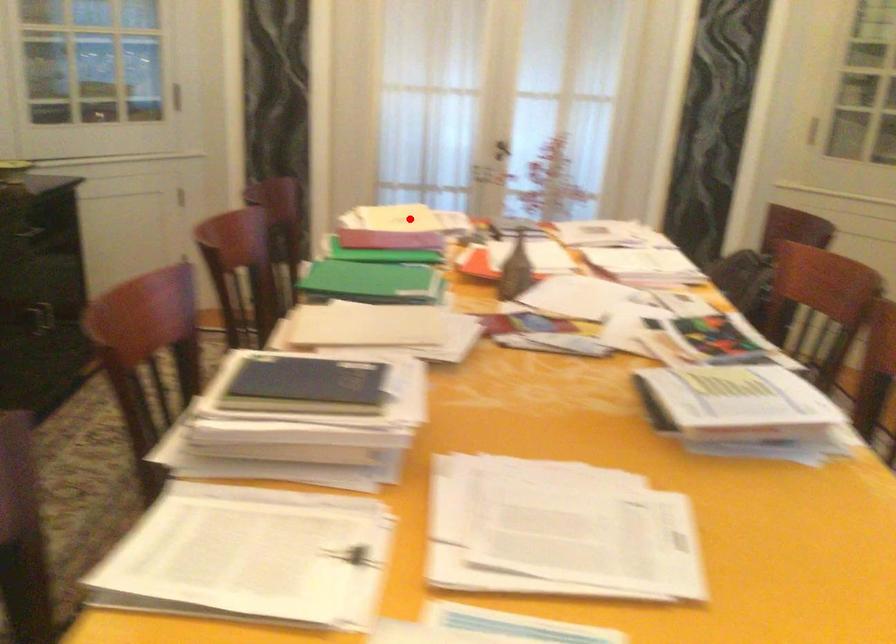
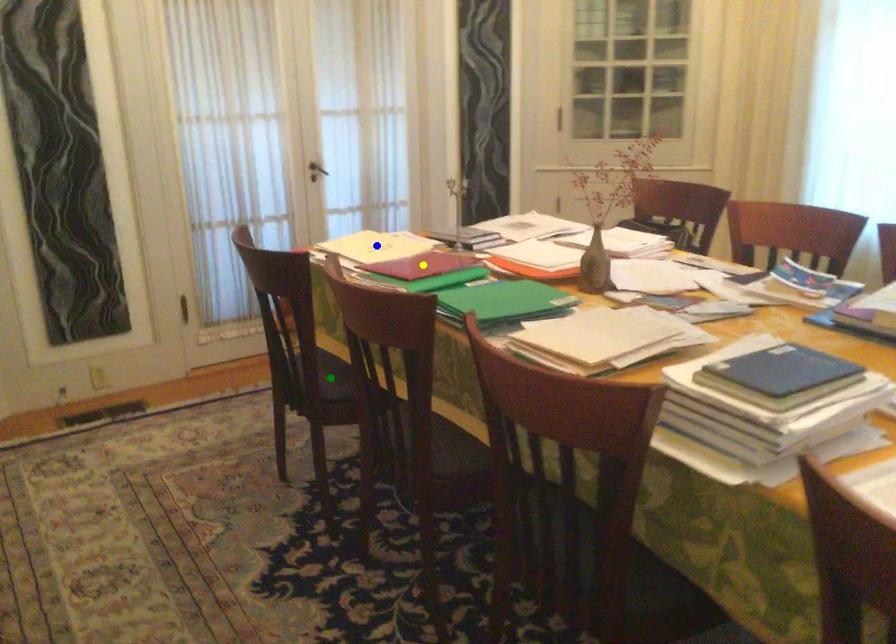
Question: I am providing you with two images of the same scene from different viewpoints. A red point is marked on the first image. You are given multiple points on the second image. Which spot in image 2 lines up with the point in image 1?

Choices:
 (A) yellow point
 (B) blue point
 (C) green point

Answer: (B)